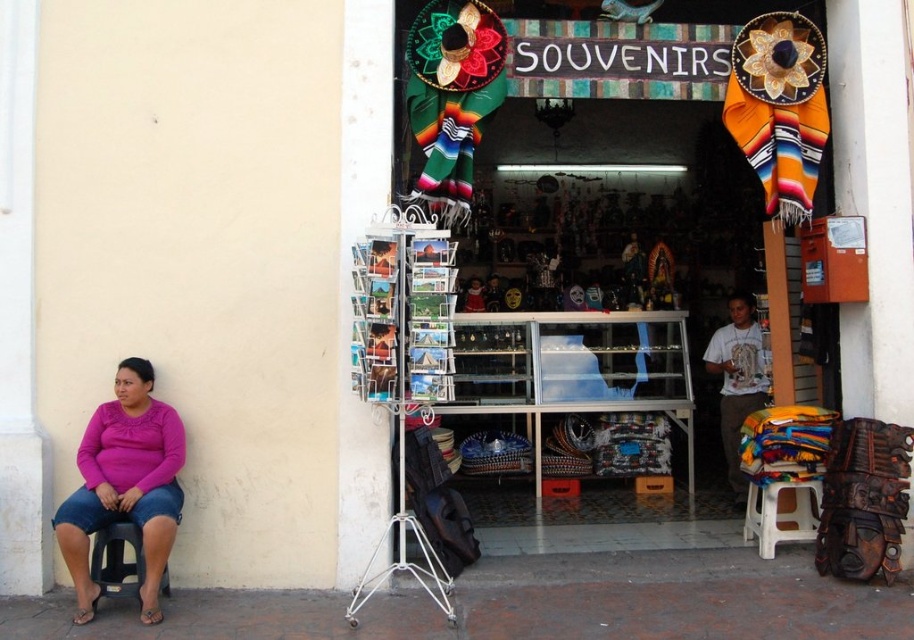
You are a customer entering the souvenir shop and notice the pink matte shirt at lower left and the white plastic stool at lower right. Which object is wider?

The pink matte shirt at lower left is wider than the white plastic stool at lower right.

You are a customer entering the souvenir shop and see the pink matte shirt at lower left and the white plastic stool at lower right. Which object is taller?

The pink matte shirt at lower left has a greater height compared to the white plastic stool at lower right, so the pink matte shirt at lower left is taller.

You are a customer standing outside the souvenir shop looking in through the window. You notice the pink matte shirt at lower left and the black plastic stool at lower left. Which object is closer to the window?

The pink matte shirt at lower left is above the black plastic stool at lower left, so the pink matte shirt at lower left is closer to the window.